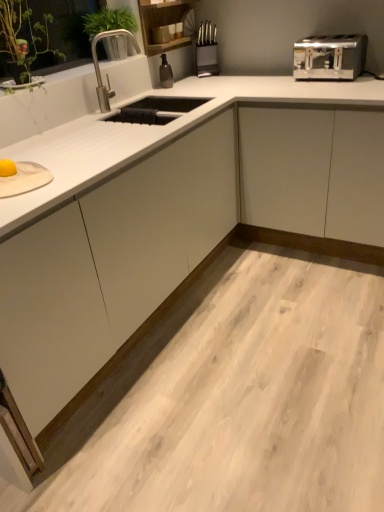
Locate an element on the screen. Image resolution: width=384 pixels, height=512 pixels. free point to the right of polished stainless steel faucet at upper left is located at coordinates (150, 111).